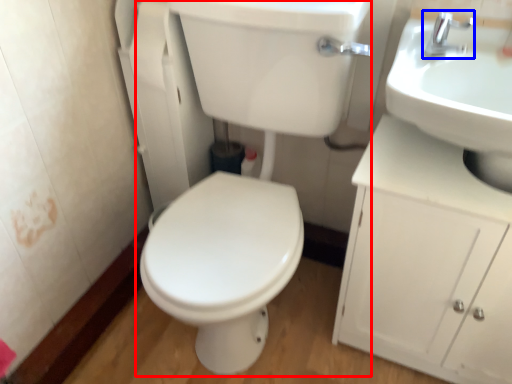
Question: Which of the following is the closest to the observer, porcelain (highlighted by a red box) or tap (highlighted by a blue box)?

Choices:
 (A) porcelain
 (B) tap

Answer: (A)